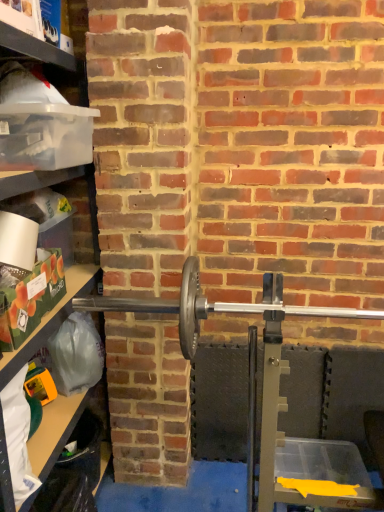
This screenshot has width=384, height=512. I want to click on polished silver barbell at center, so click(217, 307).

Describe the element at coordinates (217, 307) in the screenshot. I see `polished silver barbell at center` at that location.

This screenshot has height=512, width=384. I want to click on clear plastic container at left, so click(x=69, y=57).

This screenshot has height=512, width=384. What do you see at coordinates (69, 57) in the screenshot?
I see `clear plastic container at left` at bounding box center [69, 57].

What is the approximate height of clear plastic container at left?

1.78 meters.

Image resolution: width=384 pixels, height=512 pixels. I want to click on polished silver barbell at center, so click(x=217, y=307).

Considering the relative positions of polished silver barbell at center and clear plastic container at left in the image provided, is polished silver barbell at center to the right of clear plastic container at left from the viewer's perspective?

Yes, polished silver barbell at center is to the right of clear plastic container at left.

Relative to clear plastic container at left, is polished silver barbell at center in front or behind?

In the image, polished silver barbell at center appears behind clear plastic container at left.

Which is in front, point (359, 317) or point (82, 217)?

The point (359, 317) is closer to the camera.

From the image's perspective, would you say polished silver barbell at center is positioned over clear plastic container at left?

Correct, polished silver barbell at center appears higher than clear plastic container at left in the image.

From a real-world perspective, between polished silver barbell at center and clear plastic container at left, who is vertically lower?

clear plastic container at left is physically lower.

Does polished silver barbell at center have a lesser width compared to clear plastic container at left?

Yes.

Which of these two, polished silver barbell at center or clear plastic container at left, stands taller?

clear plastic container at left is taller.

Which of these two, polished silver barbell at center or clear plastic container at left, is smaller?

polished silver barbell at center is smaller.

Would you say polished silver barbell at center is inside or outside clear plastic container at left?

polished silver barbell at center is outside clear plastic container at left.

Is polished silver barbell at center next to clear plastic container at left and touching it?

polished silver barbell at center and clear plastic container at left are not in contact.

Is polished silver barbell at center looking in the opposite direction of clear plastic container at left?

polished silver barbell at center is not turned away from clear plastic container at left.

What's the angular difference between polished silver barbell at center and clear plastic container at left's facing directions?

polished silver barbell at center and clear plastic container at left are facing 88.6 degrees away from each other.

Where is `barbell above the clear plastic container at left (from the image's perspective)`? This screenshot has height=512, width=384. barbell above the clear plastic container at left (from the image's perspective) is located at coordinates (217, 307).

Based on the photo, considering the relative positions of clear plastic container at left and polished silver barbell at center in the image provided, is clear plastic container at left to the left of polished silver barbell at center from the viewer's perspective?

Yes.

Is the depth of clear plastic container at left less than that of polished silver barbell at center?

Yes.

Is point (5, 377) behind point (278, 335)?

No.

Based on the photo, from the image's perspective, is clear plastic container at left located beneath polished silver barbell at center?

Yes.

From a real-world perspective, is clear plastic container at left physically located above or below polished silver barbell at center?

Clearly, from a real-world perspective, clear plastic container at left is below polished silver barbell at center.

In the scene shown: Between clear plastic container at left and polished silver barbell at center, which one has smaller width?

Thinner between the two is polished silver barbell at center.

Considering the relative sizes of clear plastic container at left and polished silver barbell at center in the image provided, is clear plastic container at left taller than polished silver barbell at center?

Yes, clear plastic container at left is taller than polished silver barbell at center.

Can you confirm if clear plastic container at left is bigger than polished silver barbell at center?

Yes, clear plastic container at left is bigger than polished silver barbell at center.

Do you think clear plastic container at left is within polished silver barbell at center, or outside of it?

The correct answer is: outside.

Are clear plastic container at left and polished silver barbell at center making contact?

There is a gap between clear plastic container at left and polished silver barbell at center.

Is clear plastic container at left oriented towards polished silver barbell at center?

Yes.

Can you tell me how much clear plastic container at left and polished silver barbell at center differ in facing direction?

There is a 88.6-degree angle between the facing directions of clear plastic container at left and polished silver barbell at center.

Find the location of `shelf on the left of polished silver barbell at center`. shelf on the left of polished silver barbell at center is located at coordinates (69, 57).

Locate an element on the screen. shelf below the polished silver barbell at center (from the image's perspective) is located at coordinates (69, 57).

Locate an element on the screen. shelf on the left of polished silver barbell at center is located at coordinates (69, 57).